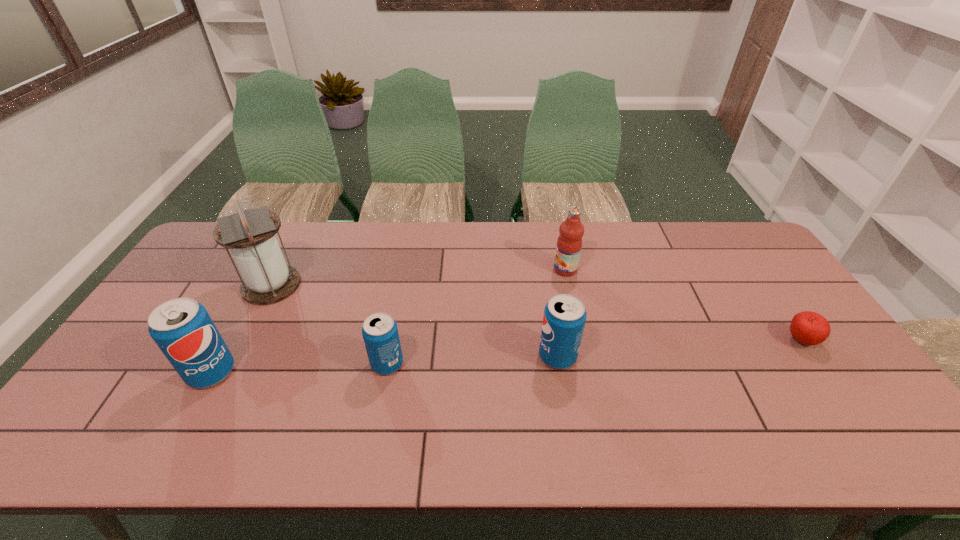
The width and height of the screenshot is (960, 540). I want to click on blank space that satisfies the following two spatial constraints: 1. on the front label of the fruit juice; 2. on the right side of the rightmost object, so click(x=581, y=341).

At what (x,y) coordinates should I click in order to perform the action: click on vacant region that satisfies the following two spatial constraints: 1. on the back side of the fifth tallest object; 2. on the left side of the rightmost soda can. Please return your answer as a coordinate pair (x, y). This screenshot has height=540, width=960. Looking at the image, I should click on (389, 356).